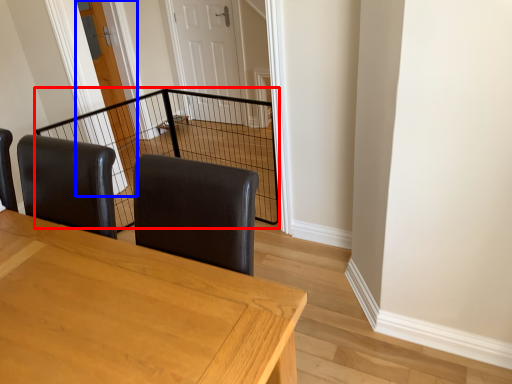
Question: Which object appears farthest to the camera in this image, cage (highlighted by a red box) or door (highlighted by a blue box)?

Choices:
 (A) cage
 (B) door

Answer: (B)